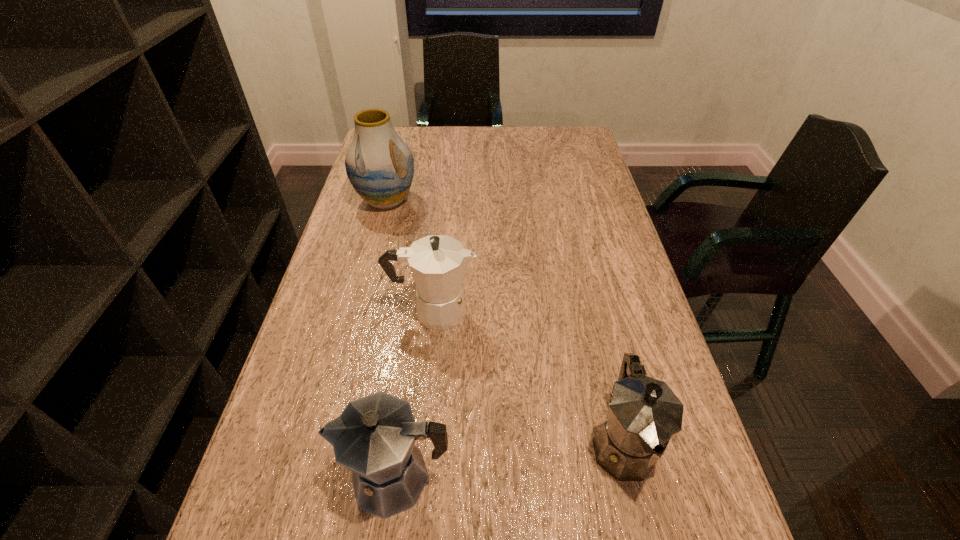
Where is `vase`? vase is located at coordinates (380, 166).

Where is `the farthest object`? The image size is (960, 540). the farthest object is located at coordinates (380, 166).

Where is `the second farthest object`? The image size is (960, 540). the second farthest object is located at coordinates (437, 262).

Where is `the rightmost object`? This screenshot has width=960, height=540. the rightmost object is located at coordinates (644, 414).

The height and width of the screenshot is (540, 960). Find the location of `free space located 0.200m on the back of the farthest object`. free space located 0.200m on the back of the farthest object is located at coordinates (398, 152).

Image resolution: width=960 pixels, height=540 pixels. I want to click on free location located 0.190m at the spout of the third nearest object, so click(x=557, y=310).

Image resolution: width=960 pixels, height=540 pixels. I want to click on vase situated at the left edge, so click(x=380, y=166).

Image resolution: width=960 pixels, height=540 pixels. In order to click on coffeepot that is at the left edge in this screenshot , I will do `click(374, 437)`.

Where is `object at the right edge`? This screenshot has height=540, width=960. object at the right edge is located at coordinates (644, 414).

Identify the location of vacant area at the far edge of the desktop. click(x=539, y=133).